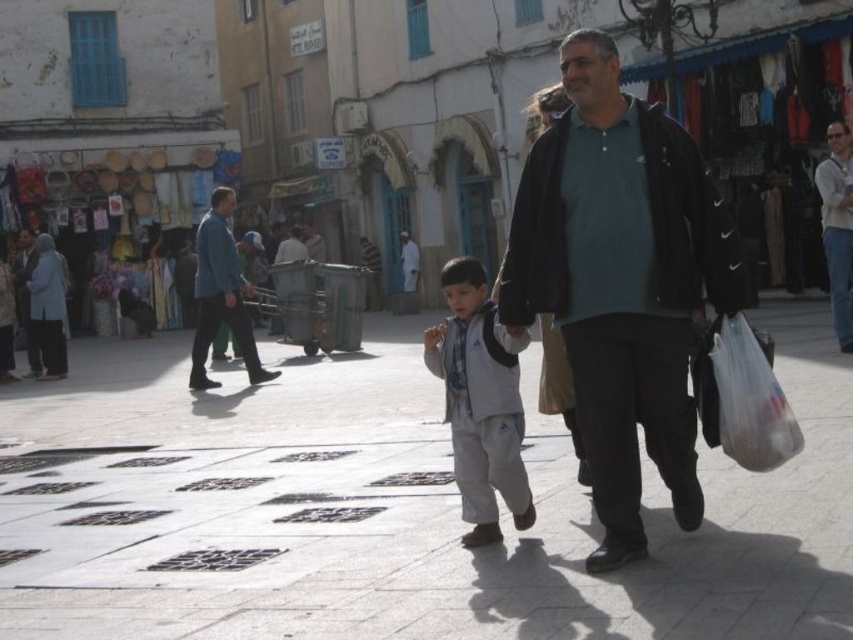
Based on the photo, can you confirm if white concrete pavement at center is thinner than blue cotton shirt at center?

Incorrect, white concrete pavement at center's width is not less than blue cotton shirt at center's.

Which is more to the left, white concrete pavement at center or blue cotton shirt at center?

From the viewer's perspective, blue cotton shirt at center appears more on the left side.

Is point (421, 497) positioned after point (268, 380)?

No, (421, 497) is closer to viewer.

Identify the location of white concrete pavement at center. (416, 513).

Between white matte jacket at center and blue cotton shirt at center, which one appears on the left side from the viewer's perspective?

Positioned to the left is blue cotton shirt at center.

Is the position of white matte jacket at center more distant than that of blue cotton shirt at center?

That is False.

Is point (457, 310) positioned behind point (236, 268)?

That is False.

Identify the location of white matte jacket at center. The height and width of the screenshot is (640, 853). (480, 401).

Is white concrete pavement at center bigger than dark green jersey at center?

Yes, white concrete pavement at center is bigger than dark green jersey at center.

Does white concrete pavement at center lie in front of dark green jersey at center?

Yes, it is in front of dark green jersey at center.

Is point (564, 593) positioned before point (643, 420)?

Yes, it is in front of point (643, 420).

This screenshot has width=853, height=640. Identify the location of white concrete pavement at center. (416, 513).